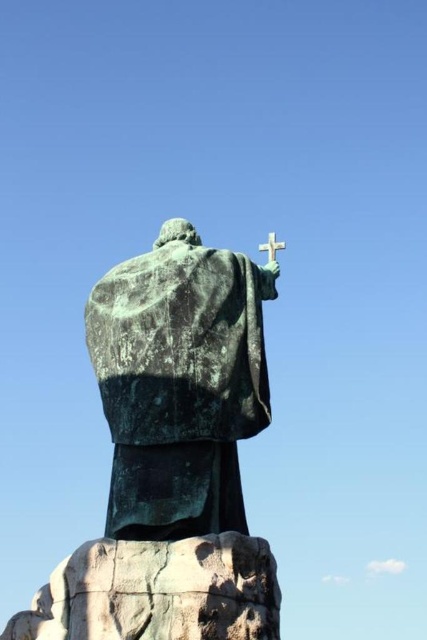
You are standing in front of the statue and want to place two markers on the ground at the coordinates point (236,424) and point (269,259). Which marker will be closer to the statue?

Result: Point (236,424) is in front of point (269,259), so the marker at point (236,424) will be closer to the statue.

You are standing in front of a statue and a cross in the background. The statue is made of green patina metal and holds the cross. From your perspective, which object is closer to you, the green patina statue at center or the white matte cross at upper center?

The green patina statue at center is closer to you because it is in front of the white matte cross at upper center.

You are an art conservator assessing the statue and cross. Which object is wider, the green patina statue at center or the white matte cross at upper center?

The green patina statue at center is wider than the white matte cross at upper center according to the description.